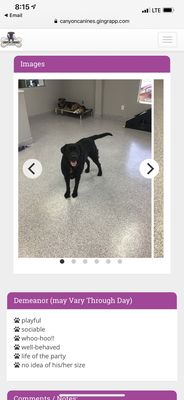
Where is `stone floor`? stone floor is located at coordinates (111, 212).